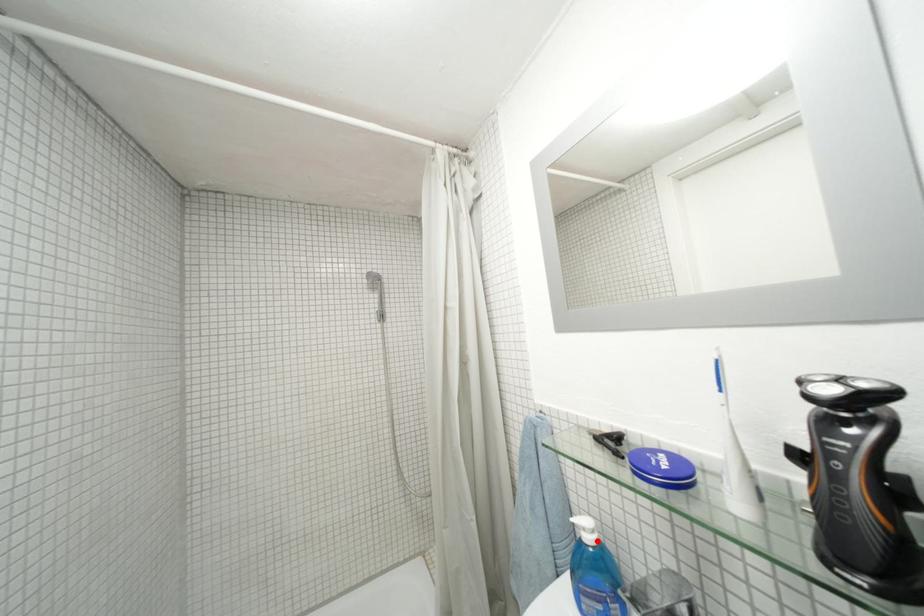
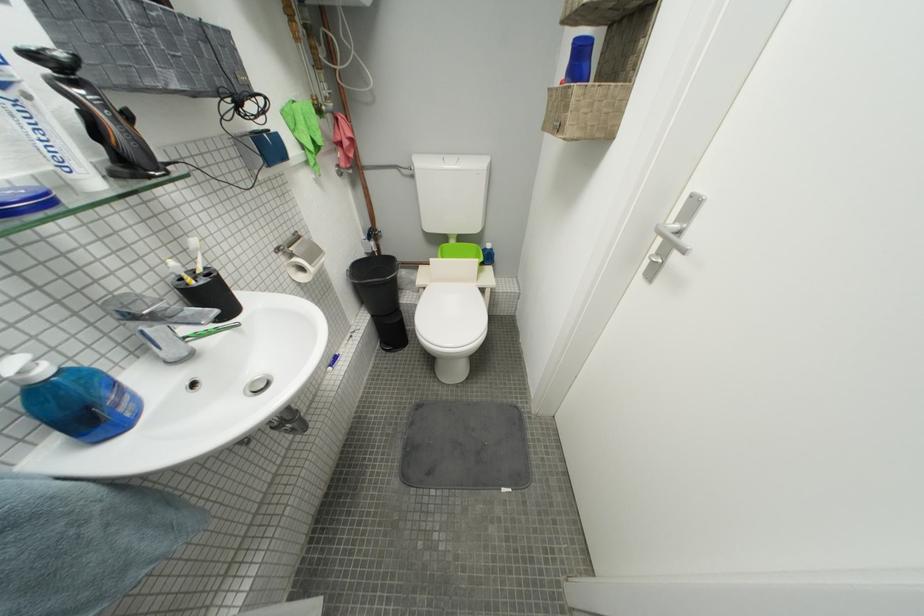
Question: I am providing you with two images of the same scene from different viewpoints. A red point is marked on the first image. Can you still see the location of the red point in image 2?

Choices:
 (A) Yes
 (B) No

Answer: (A)